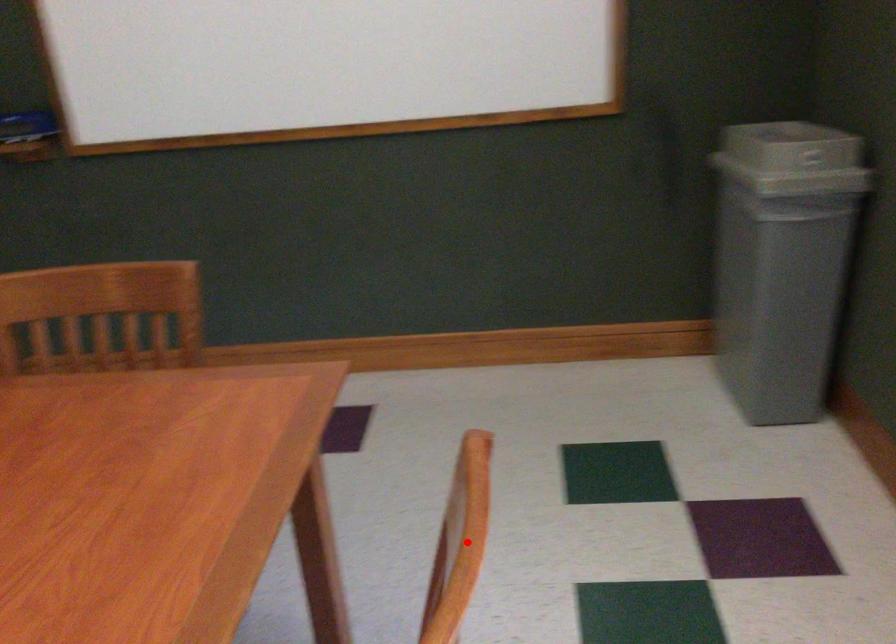
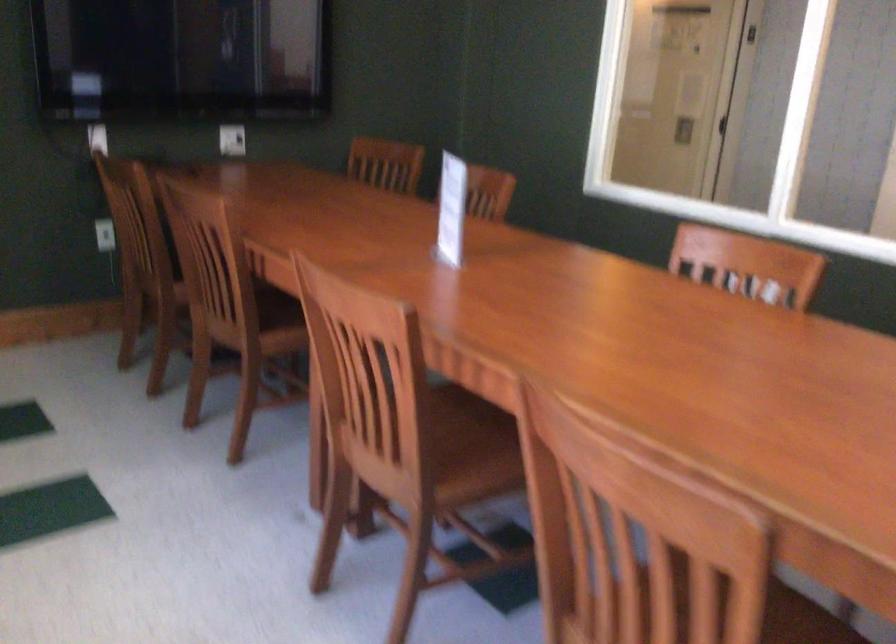
Question: I am providing you with two images of the same scene from different viewpoints. Given a red point in image1, look at the same physical point in image2. Is it:

Choices:
 (A) Closer to the viewpoint
 (B) Farther from the viewpoint

Answer: (B)